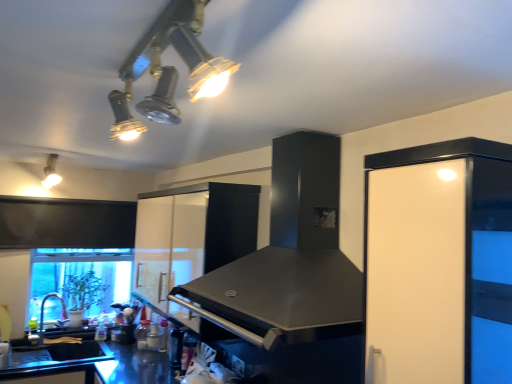
Question: From the image's perspective, is white glossy cabinet at center, placed as the first cabinetry when sorted from left to right, located beneath matte white light fixture at upper left, the second light fixture when ordered from right to left?

Choices:
 (A) yes
 (B) no

Answer: (A)

Question: From the image's perspective, is white glossy cabinet at center, the 1th cabinetry from the back, on matte white light fixture at upper left, the second light fixture when ordered from right to left?

Choices:
 (A) no
 (B) yes

Answer: (A)

Question: Could you tell me if white glossy cabinet at center, which ranks as the 2th cabinetry in right-to-left order, is facing matte white light fixture at upper left, the second light fixture when ordered from right to left?

Choices:
 (A) no
 (B) yes

Answer: (B)

Question: Considering the relative sizes of white glossy cabinet at center, positioned as the second cabinetry in front-to-back order, and matte white light fixture at upper left, which appears as the 1th light fixture when viewed from the back, in the image provided, is white glossy cabinet at center, positioned as the second cabinetry in front-to-back order, thinner than matte white light fixture at upper left, which appears as the 1th light fixture when viewed from the back,?

Choices:
 (A) no
 (B) yes

Answer: (B)

Question: Is white glossy cabinet at center, the 1th cabinetry from the back, not within matte white light fixture at upper left, which appears as the second light fixture when viewed from the front?

Choices:
 (A) yes
 (B) no

Answer: (A)

Question: Is matte white light fixture at upper left, which appears as the second light fixture when viewed from the front, taller or shorter than metallic track lights at upper center, which appears as the 1th light fixture when viewed from the right?

Choices:
 (A) short
 (B) tall

Answer: (B)

Question: Looking at the image, does matte white light fixture at upper left, arranged as the 1th light fixture when viewed from the left, seem bigger or smaller compared to metallic track lights at upper center, the second light fixture from the left?

Choices:
 (A) small
 (B) big

Answer: (B)

Question: From the image's perspective, is matte white light fixture at upper left, arranged as the 1th light fixture when viewed from the left, located above or below metallic track lights at upper center, the second light fixture from the left?

Choices:
 (A) below
 (B) above

Answer: (A)

Question: Considering their positions, is matte white light fixture at upper left, which appears as the second light fixture when viewed from the front, located in front of or behind metallic track lights at upper center, the second light fixture from the left?

Choices:
 (A) front
 (B) behind

Answer: (B)

Question: From the image's perspective, is brushed metal faucet at lower left positioned above or below black matte sink at lower left?

Choices:
 (A) below
 (B) above

Answer: (B)

Question: Is brushed metal faucet at lower left taller or shorter than black matte sink at lower left?

Choices:
 (A) short
 (B) tall

Answer: (B)

Question: Considering their positions, is brushed metal faucet at lower left located in front of or behind black matte sink at lower left?

Choices:
 (A) front
 (B) behind

Answer: (B)

Question: Considering the positions of point (45, 296) and point (28, 359), is point (45, 296) closer or farther from the camera than point (28, 359)?

Choices:
 (A) closer
 (B) farther

Answer: (B)

Question: Is point (431, 223) closer or farther from the camera than point (11, 367)?

Choices:
 (A) closer
 (B) farther

Answer: (A)

Question: Which is correct: white glossy cabinet at right, which ranks as the 1th cabinetry in front-to-back order, is inside black matte sink at lower left, or outside of it?

Choices:
 (A) outside
 (B) inside

Answer: (A)